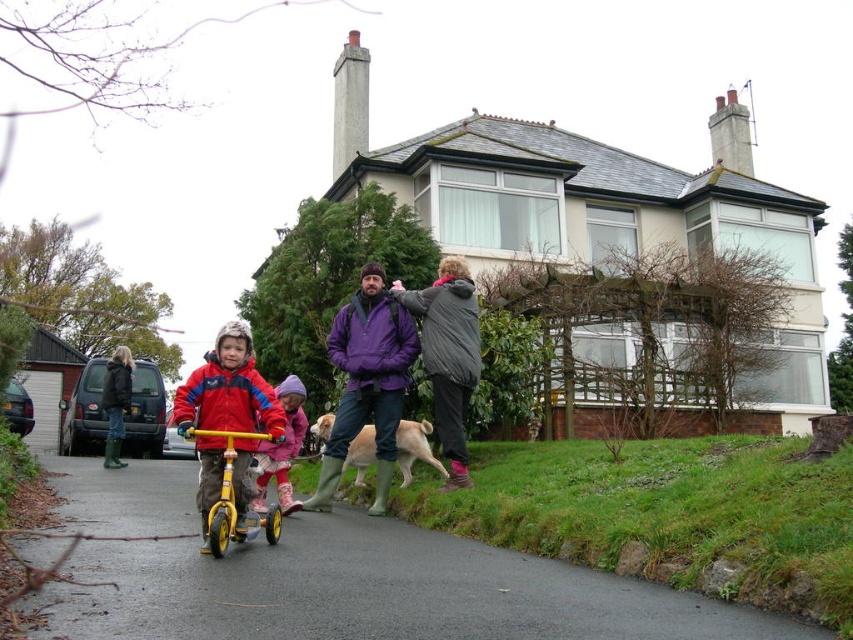
Question: Which point appears farthest from the camera in this image?

Choices:
 (A) (238, 513)
 (B) (305, 392)

Answer: (B)

Question: Can you confirm if smooth asphalt path at center is positioned to the left of purple matte jacket at center?

Choices:
 (A) no
 (B) yes

Answer: (B)

Question: Which of the following is the closest to the observer?

Choices:
 (A) matte pink snowsuit at center
 (B) smooth asphalt path at center
 (C) purple matte jacket at center

Answer: (B)

Question: Which object is positioned farthest from the red fleece jacket at center?

Choices:
 (A) matte pink snowsuit at center
 (B) smooth asphalt path at center
 (C) yellow matte bicycle at center
 (D) purple matte jacket at center

Answer: (D)

Question: Does smooth asphalt path at center have a greater width compared to red fleece jacket at center?

Choices:
 (A) no
 (B) yes

Answer: (B)

Question: Does purple matte jacket at center have a larger size compared to yellow matte bicycle at center?

Choices:
 (A) yes
 (B) no

Answer: (B)